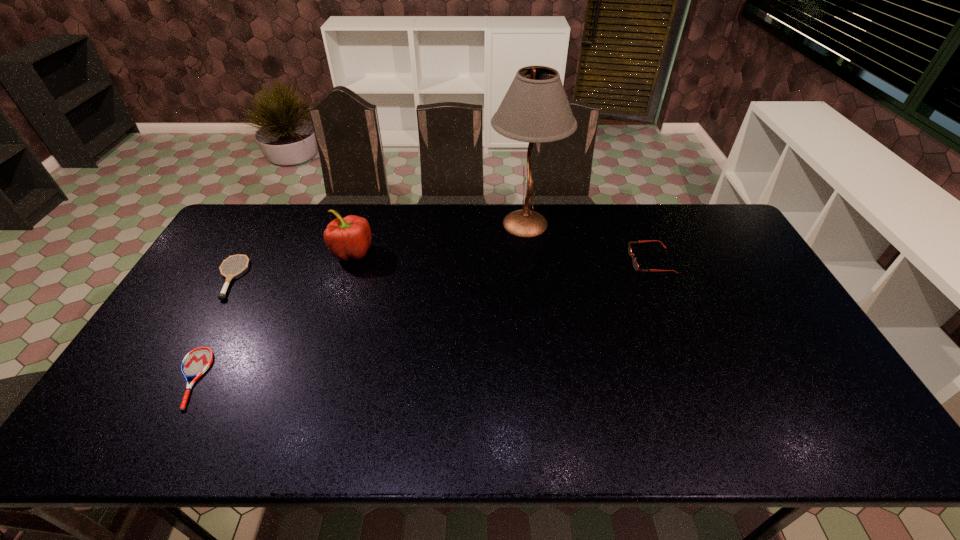
This screenshot has width=960, height=540. I want to click on free space located 0.240m on the front-facing side of the tallest object, so click(x=421, y=224).

Where is `vacant space positioned on the front-facing side of the tallest object`? The height and width of the screenshot is (540, 960). vacant space positioned on the front-facing side of the tallest object is located at coordinates (442, 224).

Where is `free space located 0.050m on the front-facing side of the tallest object`? The width and height of the screenshot is (960, 540). free space located 0.050m on the front-facing side of the tallest object is located at coordinates (475, 224).

Find the location of a particular element. blank area located 0.070m on the front of the bell pepper is located at coordinates (343, 283).

The image size is (960, 540). In order to click on vacant area situated 0.180m on the lenses of the spectacles in this screenshot , I will do `click(574, 261)`.

I want to click on free point located on the lenses of the spectacles, so click(546, 261).

At what (x,y) coordinates should I click in order to perform the action: click on vacant space located on the lenses of the spectacles. Please return your answer as a coordinate pair (x, y). The width and height of the screenshot is (960, 540). Looking at the image, I should click on (556, 261).

Locate an element on the screen. free location located on the right of the taller tennis racket is located at coordinates (337, 278).

The width and height of the screenshot is (960, 540). I want to click on free space located on the right of the nearest object, so click(335, 378).

The height and width of the screenshot is (540, 960). Find the location of `table lamp at the far edge`. table lamp at the far edge is located at coordinates (535, 109).